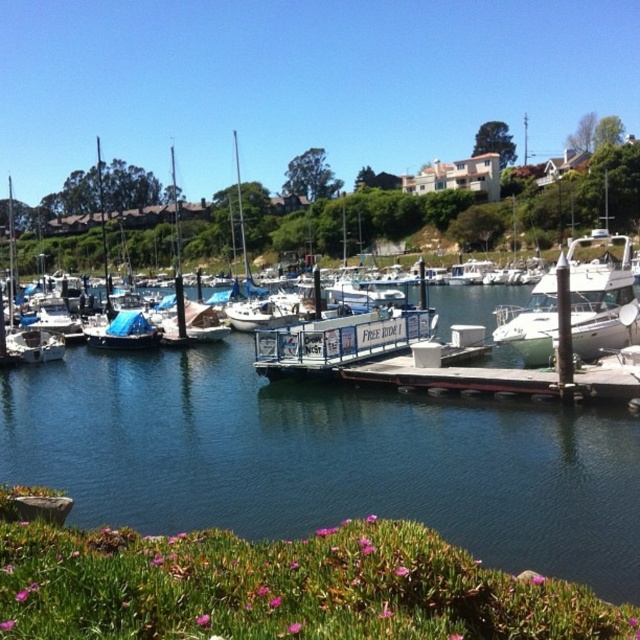
Does point (340, 416) come farther from viewer compared to point (566, 396)?

Yes, point (340, 416) is farther from viewer.

Between clear blue water at center and wooden dock at center, which one appears on the left side from the viewer's perspective?

From the viewer's perspective, clear blue water at center appears more on the left side.

Which is behind, point (115, 403) or point (580, 392)?

The point (115, 403) is behind.

You are a GUI agent. You are given a task and a screenshot of the screen. Output one action in this format:
    pyautogui.click(x=<x>, y=<y>)
    Task: Click on the clear blue water at center
    
    Given the screenshot: What is the action you would take?
    [x=324, y=458]

Is white matte sailboat at left closer to camera compared to white glossy boat at center?

No, it is not.

Who is lower down, white matte sailboat at left or white glossy boat at center?

white glossy boat at center is below.

Between point (492, 204) and point (580, 296), which one is positioned in front?

Point (580, 296) is in front.

The width and height of the screenshot is (640, 640). What are the coordinates of `white matte sailboat at left` in the screenshot? It's located at (458, 211).

Identify the location of blue painted metal dock at center. 339,340.

This screenshot has width=640, height=640. What do you see at coordinates (339, 340) in the screenshot?
I see `blue painted metal dock at center` at bounding box center [339, 340].

Identify the location of blue painted metal dock at center. The height and width of the screenshot is (640, 640). (339, 340).